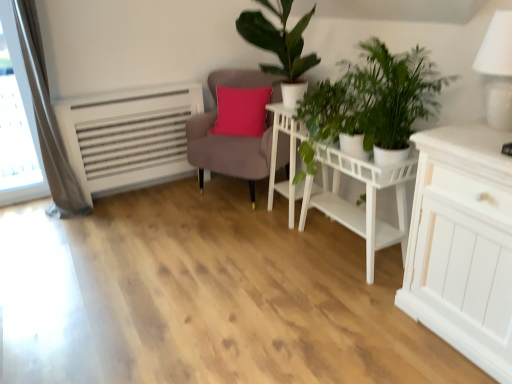
Where is `green matte plant at upper center, positioned as the second houseplant in front-to-back order`? green matte plant at upper center, positioned as the second houseplant in front-to-back order is located at coordinates point(280,47).

Image resolution: width=512 pixels, height=384 pixels. What are the coordinates of `white curtain at left` in the screenshot? It's located at (23, 109).

Find the location of a particular element. green leafy plant at center is located at coordinates (337, 110).

What are the coordinates of `green leafy plant at center right, which ranks as the second houseplant in back-to-front order` in the screenshot? It's located at (372, 101).

Based on the photo, how much space does green leafy plant at center right, which ranks as the second houseplant in back-to-front order, occupy vertically?

green leafy plant at center right, which ranks as the second houseplant in back-to-front order, is 25.84 inches tall.

Where is `gray fabric curtain at left`? gray fabric curtain at left is located at coordinates tap(47, 118).

Where is `green matte plant at upper center, positioned as the second houseplant in front-to-back order`? The height and width of the screenshot is (384, 512). green matte plant at upper center, positioned as the second houseplant in front-to-back order is located at coordinates (280, 47).

From the image's perspective, between matte brown armchair at center and white matte table at center, which one is located above?

matte brown armchair at center, from the image's perspective.

Is white matte table at center surrounded by matte brown armchair at center?

No, white matte table at center is not surrounded by matte brown armchair at center.

Where is `table below the matte brown armchair at center (from the image's perspective)`? The image size is (512, 384). table below the matte brown armchair at center (from the image's perspective) is located at coordinates (338, 189).

Is matte brown armchair at center oriented towards white matte table at center?

No, matte brown armchair at center is not facing towards white matte table at center.

Does white glossy table lamp at upper right contain matte brown armchair at center?

No, matte brown armchair at center is not a part of white glossy table lamp at upper right.

In terms of size, does white glossy table lamp at upper right appear bigger or smaller than matte brown armchair at center?

In the image, white glossy table lamp at upper right appears to be smaller than matte brown armchair at center.

Is point (510, 90) in front of point (227, 144)?

Yes.

This screenshot has height=384, width=512. Find the location of `chair that appears behind the white glossy table lamp at upper right`. chair that appears behind the white glossy table lamp at upper right is located at coordinates (229, 150).

Consider the image. Is there a large distance between green leafy plant at center and matte brown armchair at center?

green leafy plant at center is actually quite close to matte brown armchair at center.

Is green leafy plant at center oriented towards matte brown armchair at center?

No, green leafy plant at center is not aimed at matte brown armchair at center.

Is green leafy plant at center to the right of matte brown armchair at center from the viewer's perspective?

Correct, you'll find green leafy plant at center to the right of matte brown armchair at center.

From the image's perspective, which one is positioned higher, white curtain at left or green leafy plant at center?

white curtain at left appears higher in the image.

Which of these two, white curtain at left or green leafy plant at center, is thinner?

white curtain at left.

Considering the sizes of objects white curtain at left and green leafy plant at center in the image provided, who is shorter, white curtain at left or green leafy plant at center?

green leafy plant at center is shorter.

From the picture: Between white curtain at left and green leafy plant at center, which one is positioned behind?

white curtain at left is more distant.

Is gray fabric curtain at left turned away from white glossy table lamp at upper right?

No, white glossy table lamp at upper right is not at the back of gray fabric curtain at left.

From the image's perspective, is gray fabric curtain at left over white glossy table lamp at upper right?

Yes, from the image's perspective, gray fabric curtain at left is above white glossy table lamp at upper right.

Looking at this image, considering the sizes of objects gray fabric curtain at left and white glossy table lamp at upper right in the image provided, who is shorter, gray fabric curtain at left or white glossy table lamp at upper right?

white glossy table lamp at upper right.

Can we say gray fabric curtain at left lies outside white glossy table lamp at upper right?

Yes.

From the picture: Considering the positions of objects white matte side table at center and white matte table at center in the image provided, who is behind, white matte side table at center or white matte table at center?

white matte side table at center is further away from the camera.

Is point (323, 174) less distant than point (276, 150)?

Yes, point (323, 174) is closer to viewer.

Where is `table that appears in front of the white matte side table at center`? table that appears in front of the white matte side table at center is located at coordinates (338, 189).

Consider the image. Considering their positions, is green leafy plant at center right, which is the first houseplant in front-to-back order, located in front of or behind white glossy table lamp at upper right?

Visually, green leafy plant at center right, which is the first houseplant in front-to-back order, is located behind white glossy table lamp at upper right.

At what (x,y) coordinates should I click in order to perform the action: click on the 2nd houseplant below the white glossy table lamp at upper right (from a real-world perspective). Please return your answer as a coordinate pair (x, y). The width and height of the screenshot is (512, 384). Looking at the image, I should click on (372, 101).

Between point (386, 83) and point (497, 25), which one is positioned in front?

The point (497, 25) is in front.

You are a GUI agent. You are given a task and a screenshot of the screen. Output one action in this format:
    pyautogui.click(x=<x>, y=<y>)
    Task: Click on the table that appears below the matte brown armchair at center (from the image's perspective)
    The image size is (512, 384).
    Given the screenshot: What is the action you would take?
    pyautogui.click(x=338, y=189)

This screenshot has height=384, width=512. I want to click on table lamp in front of the matte brown armchair at center, so click(x=497, y=70).

Considering their positions, is green leafy plant at center right, which is the first houseplant in front-to-back order, positioned further to white matte side table at center than green matte plant at upper center, positioned as the second houseplant in front-to-back order?

green leafy plant at center right, which is the first houseplant in front-to-back order, lies further to white matte side table at center than the other object.

When comparing their distances from green leafy plant at center, does green leafy plant at center right, which ranks as the second houseplant in back-to-front order, or white matte side table at center seem closer?

Based on the image, green leafy plant at center right, which ranks as the second houseplant in back-to-front order, appears to be nearer to green leafy plant at center.

Considering their positions, is white matte table at center positioned further to green matte plant at upper center, which ranks as the 1th houseplant in back-to-front order, than green leafy plant at center?

Among the two, white matte table at center is located further to green matte plant at upper center, which ranks as the 1th houseplant in back-to-front order.

Considering their positions, is white glossy table lamp at upper right positioned closer to white matte table at center than matte brown armchair at center?

matte brown armchair at center.

In the scene shown: Estimate the real-world distances between objects in this image. Which object is further from white curtain at left, white glossy table lamp at upper right or matte brown armchair at center?

Based on the image, white glossy table lamp at upper right appears to be further to white curtain at left.

From the image, which object appears to be farther from green matte plant at upper center, which ranks as the 1th houseplant in back-to-front order, white matte table at center or white curtain at left?

white curtain at left is positioned further to the anchor green matte plant at upper center, which ranks as the 1th houseplant in back-to-front order.

When comparing their distances from green leafy plant at center, does white glossy table lamp at upper right or white curtain at left seem closer?

The object closer to green leafy plant at center is white glossy table lamp at upper right.

Considering their positions, is white curtain at left positioned closer to matte brown armchair at center than green leafy plant at center?

Among the two, green leafy plant at center is located nearer to matte brown armchair at center.

Locate an element on the screen. curtain located between white curtain at left and green leafy plant at center right, which is the first houseplant in front-to-back order, in the left-right direction is located at coordinates (47, 118).

This screenshot has height=384, width=512. In order to click on chair between white curtain at left and green leafy plant at center in the horizontal direction in this screenshot , I will do `click(229, 150)`.

Locate an element on the screen. This screenshot has width=512, height=384. plant between matte brown armchair at center and white matte table at center is located at coordinates (337, 110).

The height and width of the screenshot is (384, 512). I want to click on side table between white glossy table lamp at upper right and matte brown armchair at center in the front-back direction, so click(x=289, y=157).